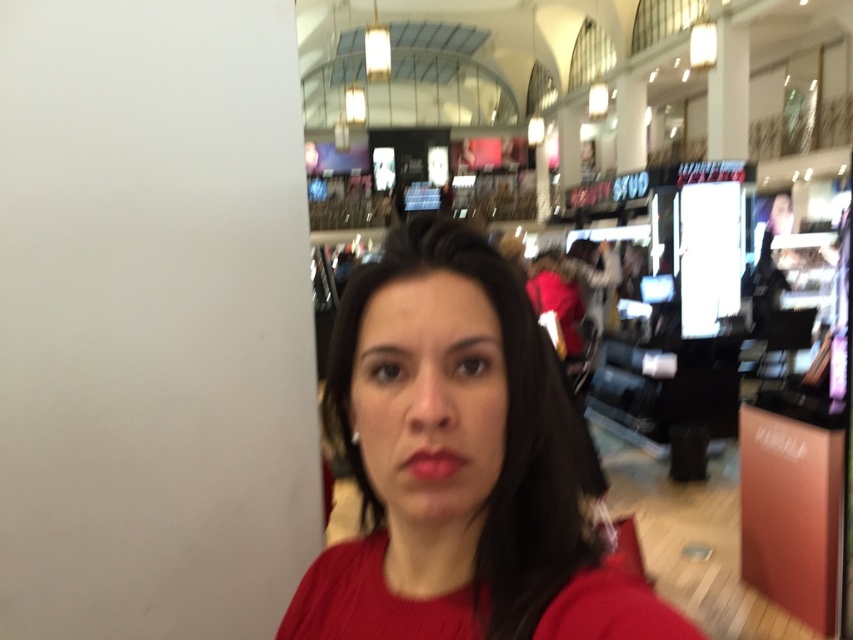
You are standing at the entrance of the mall and see the matte red sweater at center in the distance. If you walk straight ahead, will the sweater remain in your line of sight? Please explain your reasoning based on its position.

The matte red sweater at center is located at coordinates point (463,467), which is near the center of the image. Since it is centrally positioned, walking straight ahead would likely keep it within your line of sight as you move forward.

You are a fashion stylist trying to decide whether to recommend a matte red sweater at center or a matte red lipstick at center to a client. Based on their positions in the image, which item is positioned to the right of the other?

The matte red sweater at center is to the right of the matte red lipstick at center.